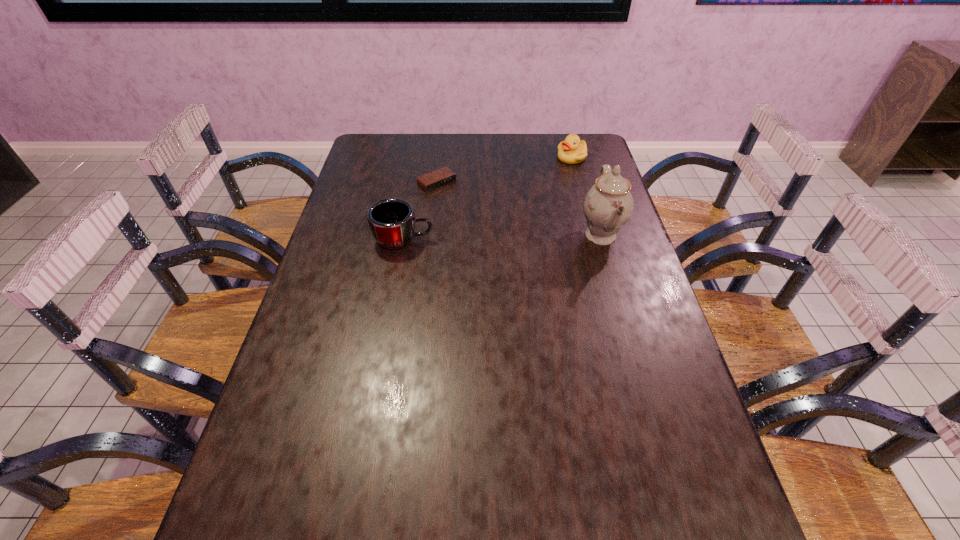
Identify the location of free space at the right edge of the desktop. (581, 193).

Identify the location of blank area at the near left corner. The image size is (960, 540). click(x=277, y=505).

I want to click on free space at the far right corner, so click(x=588, y=141).

This screenshot has width=960, height=540. In the image, there is a desktop. In order to click on free space at the near right corner in this screenshot , I will do `click(675, 461)`.

Locate an element on the screen. The image size is (960, 540). empty space between the mug and the farthest object is located at coordinates (488, 199).

The image size is (960, 540). In order to click on unoccupied position between the second farthest object and the mug in this screenshot , I will do `click(420, 212)`.

This screenshot has width=960, height=540. I want to click on vacant space that's between the mug and the shortest object, so click(x=420, y=212).

Find the location of `free spot between the duckling and the shortest object`. free spot between the duckling and the shortest object is located at coordinates (504, 171).

The image size is (960, 540). I want to click on free space between the alarm clock and the duckling, so 504,171.

The width and height of the screenshot is (960, 540). I want to click on free space that is in between the alarm clock and the mug, so click(420, 212).